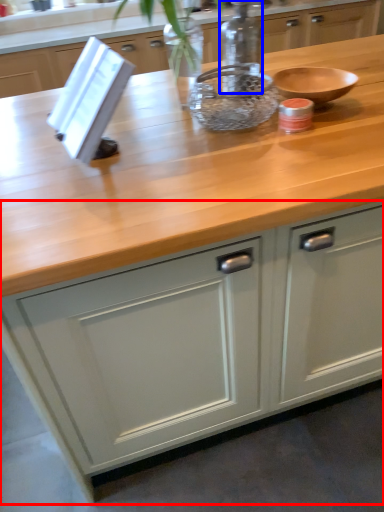
Question: Which object appears closest to the camera in this image, cabinetry (highlighted by a red box) or bottle (highlighted by a blue box)?

Choices:
 (A) cabinetry
 (B) bottle

Answer: (A)